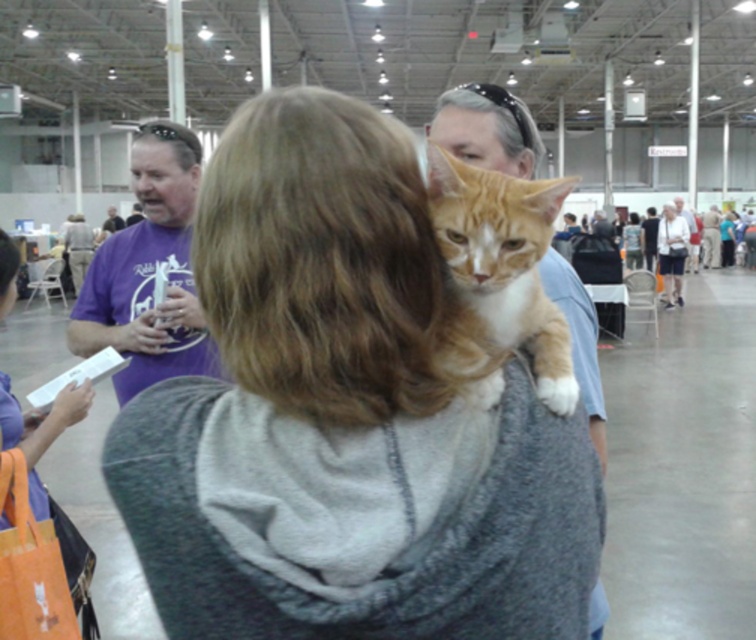
Question: Is orange fur cat at upper center wider than smooth blue shirt at upper right?

Choices:
 (A) yes
 (B) no

Answer: (A)

Question: Is gray hoodie at center positioned at the back of smooth blue shirt at upper right?

Choices:
 (A) no
 (B) yes

Answer: (A)

Question: Based on their relative distances, which object is nearer to the orange fur cat at upper center?

Choices:
 (A) gray hoodie at center
 (B) smooth blue shirt at upper right

Answer: (A)

Question: Among these objects, which one is nearest to the camera?

Choices:
 (A) purple fabric bag at lower left
 (B) gray hoodie at center
 (C) purple t-shirt at left
 (D) orange fur cat at upper center

Answer: (B)

Question: Is gray hoodie at center positioned at the back of purple fabric bag at lower left?

Choices:
 (A) no
 (B) yes

Answer: (A)

Question: Which point is farther to the camera?

Choices:
 (A) (469, 337)
 (B) (364, 552)
 (C) (150, 237)

Answer: (C)